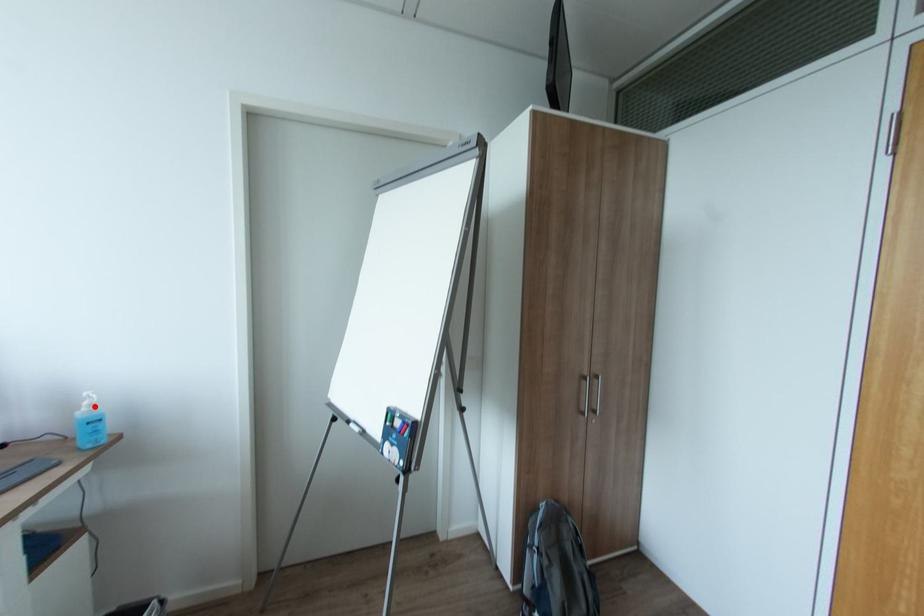
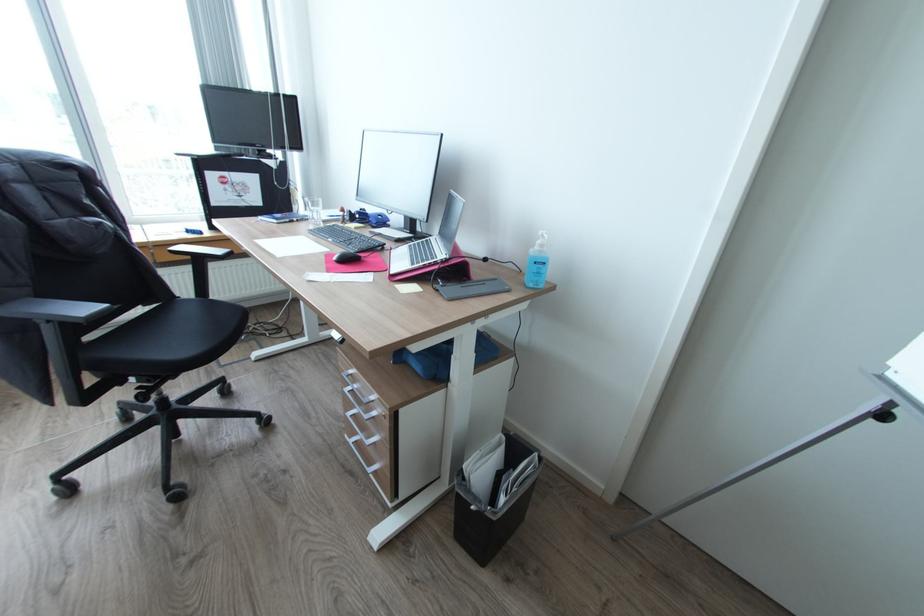
The point at the highlighted location is marked in the first image. Where is the corresponding point in the second image?

(545, 245)